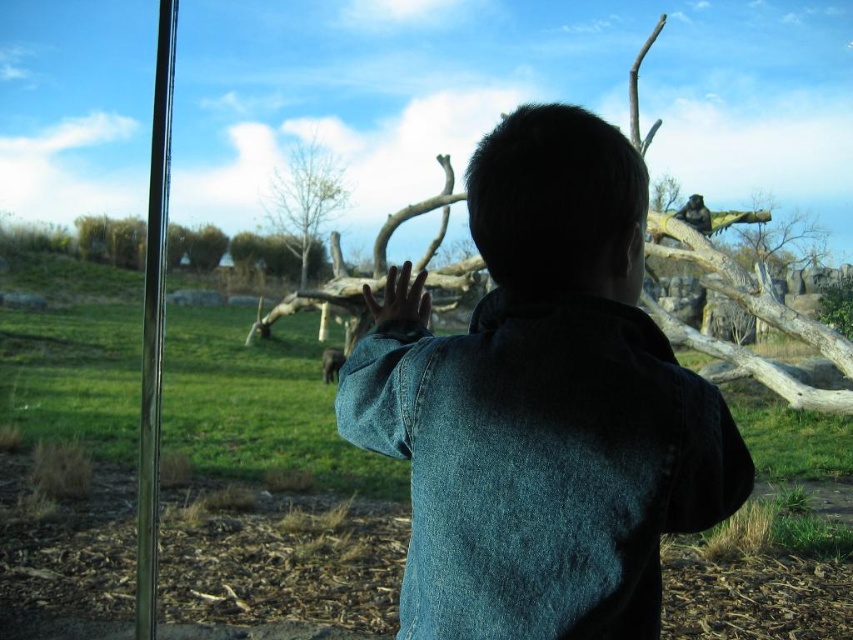
Question: Which of the following is the farthest from the observer?

Choices:
 (A) brown textured log at upper right
 (B) grayish-brown fur elephant at center
 (C) shiny black monkey at upper right

Answer: (A)

Question: Which point appears closest to the camera in this image?

Choices:
 (A) (601, 477)
 (B) (708, 227)
 (C) (763, 257)
 (D) (270, 182)

Answer: (A)

Question: Which of the following is the closest to the observer?

Choices:
 (A) (701, 230)
 (B) (338, 349)
 (C) (431, 449)

Answer: (C)

Question: Is bare wood tree at upper center above shiny black monkey at upper right?

Choices:
 (A) no
 (B) yes

Answer: (B)

Question: From the image, what is the correct spatial relationship of denim jacket at center in relation to grayish-brown fur elephant at center?

Choices:
 (A) right
 (B) left

Answer: (A)

Question: Is bare wood tree at upper center positioned before grayish-brown fur elephant at center?

Choices:
 (A) no
 (B) yes

Answer: (A)